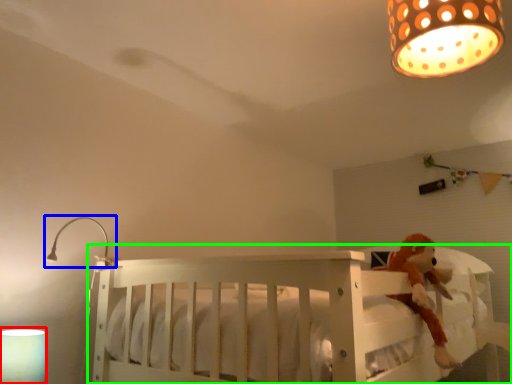
Question: Which object is the closest to the lamp (highlighted by a red box)? Choose among these: lamp (highlighted by a blue box) or infant bed (highlighted by a green box).

Choices:
 (A) lamp
 (B) infant bed

Answer: (A)